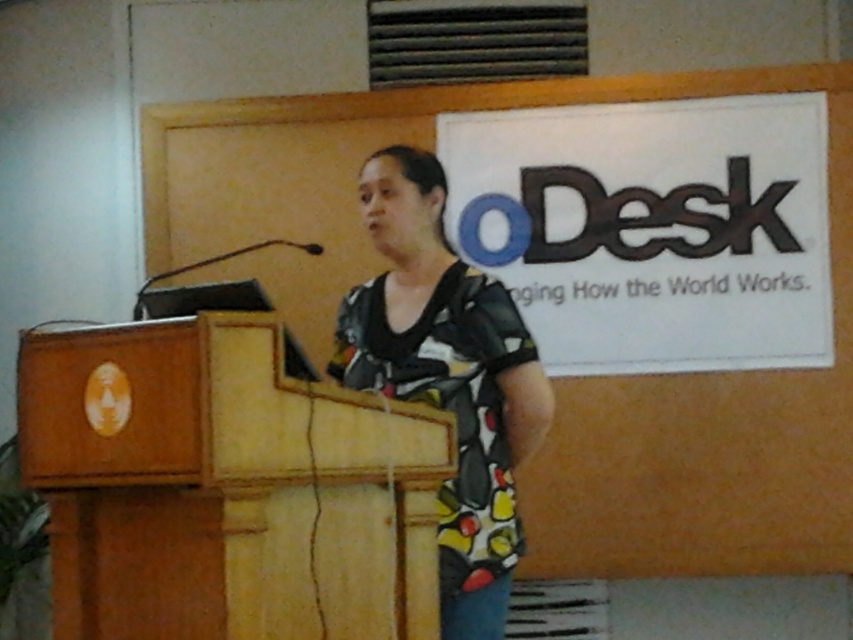
Question: From the image, what is the correct spatial relationship of wooden podium at center in relation to printed fabric blouse at center?

Choices:
 (A) above
 (B) below

Answer: (B)

Question: Which point appears farthest from the camera in this image?

Choices:
 (A) (287, 515)
 (B) (500, 600)

Answer: (B)

Question: Does wooden podium at center come in front of printed fabric blouse at center?

Choices:
 (A) yes
 (B) no

Answer: (A)

Question: Does wooden podium at center have a smaller size compared to printed fabric blouse at center?

Choices:
 (A) yes
 (B) no

Answer: (A)

Question: Among these points, which one is farthest from the camera?

Choices:
 (A) tap(497, 394)
 (B) tap(286, 627)

Answer: (A)